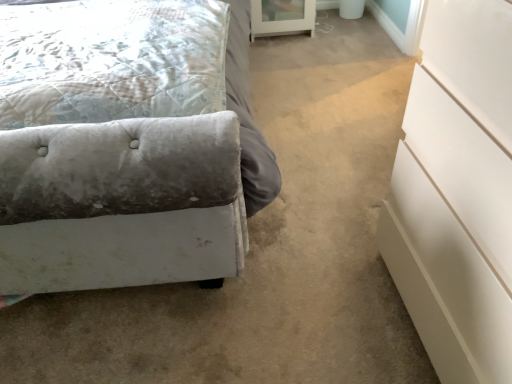
Question: Considering the relative sizes of velvet tufted pillow at left and white glass cabinet at upper center in the image provided, is velvet tufted pillow at left smaller than white glass cabinet at upper center?

Choices:
 (A) yes
 (B) no

Answer: (B)

Question: Is velvet tufted pillow at left not close to white glass cabinet at upper center?

Choices:
 (A) no
 (B) yes

Answer: (B)

Question: Does velvet tufted pillow at left have a lesser height compared to white glass cabinet at upper center?

Choices:
 (A) no
 (B) yes

Answer: (B)

Question: Can you confirm if velvet tufted pillow at left is positioned to the left of white glass cabinet at upper center?

Choices:
 (A) yes
 (B) no

Answer: (A)

Question: Is velvet tufted pillow at left aimed at white glass cabinet at upper center?

Choices:
 (A) yes
 (B) no

Answer: (B)

Question: Is velvet tufted pillow at left positioned behind white glass cabinet at upper center?

Choices:
 (A) yes
 (B) no

Answer: (B)

Question: Considering the relative sizes of velvet tufted pillow at left and velvet gray bed at lower left in the image provided, is velvet tufted pillow at left taller than velvet gray bed at lower left?

Choices:
 (A) no
 (B) yes

Answer: (A)

Question: Is the surface of velvet tufted pillow at left in direct contact with velvet gray bed at lower left?

Choices:
 (A) no
 (B) yes

Answer: (A)

Question: From a real-world perspective, is velvet tufted pillow at left on top of velvet gray bed at lower left?

Choices:
 (A) yes
 (B) no

Answer: (A)

Question: Is velvet tufted pillow at left located outside velvet gray bed at lower left?

Choices:
 (A) yes
 (B) no

Answer: (B)

Question: From the image's perspective, does velvet tufted pillow at left appear higher than velvet gray bed at lower left?

Choices:
 (A) yes
 (B) no

Answer: (B)

Question: Does velvet tufted pillow at left have a larger size compared to velvet gray bed at lower left?

Choices:
 (A) no
 (B) yes

Answer: (A)

Question: Is white glass cabinet at upper center in front of white glossy chest of drawers at right?

Choices:
 (A) yes
 (B) no

Answer: (B)